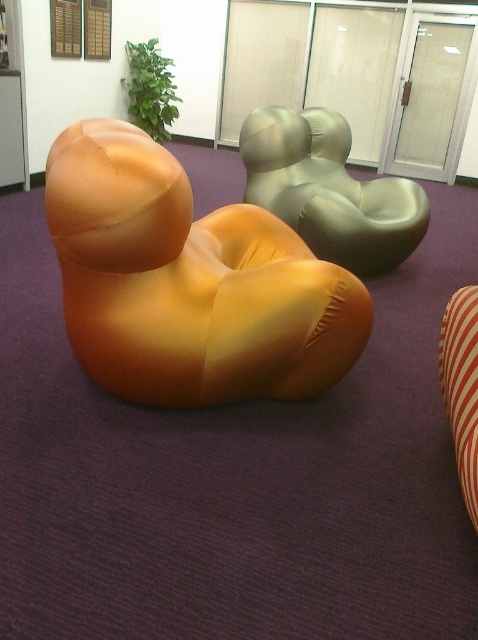
You are organizing a small meeting in the office and need to place two chairs close together. The matte orange bean bag at center and the metallic green chair at center are available. Considering their widths, which chair should you choose to ensure they can fit side by side without overlapping?

The matte orange bean bag at center has a lesser width compared to the metallic green chair at center, so choosing the matte orange bean bag at center would allow both chairs to fit side by side without overlapping.

You are sitting on the metallic green chair at center and want to reach the matte orange bean bag at center. Can you move directly forward without any obstacles?

The matte orange bean bag at center is in front of the metallic green chair at center, so there is an obstacle in your path. You cannot move directly forward without encountering the bean bag.

You are a delivery person who needs to place a new 3.5 feet wide package between the matte orange bean bag at center and the metallic green chair at center. Can you fit the package between them without moving either object?

The distance between the matte orange bean bag at center and the metallic green chair at center is 5.23 feet. Since the package is 3.5 feet wide, there is enough space to place it between them without moving either object.